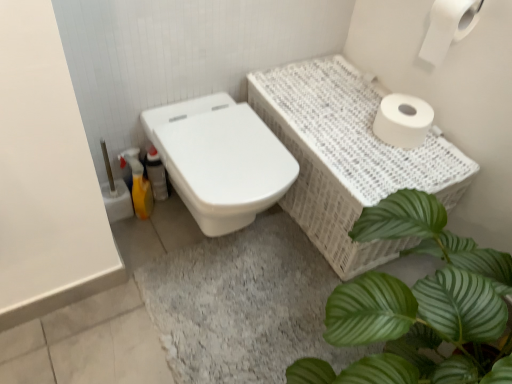
Question: Considering the relative positions of yellow plastic bottle at lower left and white matte toilet paper at upper right, the second toilet paper from the top, in the image provided, is yellow plastic bottle at lower left to the left or to the right of white matte toilet paper at upper right, the second toilet paper from the top,?

Choices:
 (A) left
 (B) right

Answer: (A)

Question: In terms of size, does yellow plastic bottle at lower left appear bigger or smaller than white matte toilet paper at upper right, the second toilet paper from the top?

Choices:
 (A) big
 (B) small

Answer: (B)

Question: Based on their relative distances, which object is nearer to the translucent plastic bottle at lower left?

Choices:
 (A) white glossy toilet at center
 (B) white matte toilet paper at upper right, the first toilet paper when ordered from top to bottom
 (C) green leafy plant at lower right
 (D) white matte toilet paper at upper right, the second toilet paper from the top
 (E) yellow plastic bottle at lower left

Answer: (E)

Question: Estimate the real-world distances between objects in this image. Which object is closer to the white matte toilet paper at upper right, which appears as the first toilet paper when ordered from the bottom?

Choices:
 (A) white matte toilet paper at upper right, positioned as the 2th toilet paper in bottom-to-top order
 (B) white glossy toilet at center
 (C) green leafy plant at lower right
 (D) yellow plastic bottle at lower left
 (E) white wicker basket at upper right

Answer: (E)